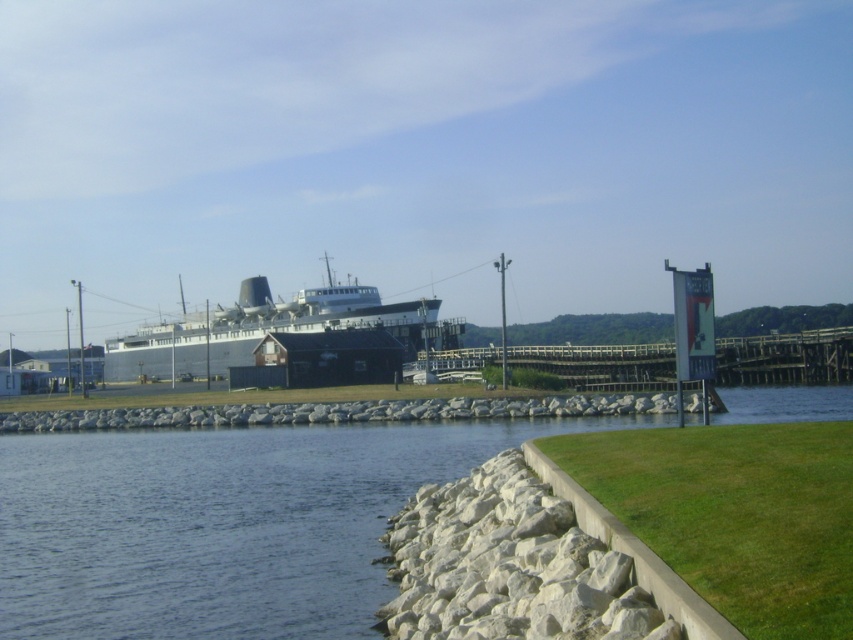
Does clear water at lower left appear on the right side of wooden planks at center?

No, clear water at lower left is not to the right of wooden planks at center.

Is point (369, 426) farther from camera compared to point (612, 346)?

No.

This screenshot has width=853, height=640. I want to click on clear water at lower left, so click(x=213, y=524).

Can you confirm if clear water at lower left is shorter than gray metallic ship at center?

Yes, clear water at lower left is shorter than gray metallic ship at center.

Can you confirm if clear water at lower left is smaller than gray metallic ship at center?

Indeed, clear water at lower left has a smaller size compared to gray metallic ship at center.

Which is behind, point (218, 570) or point (374, 308)?

The point (374, 308) is more distant.

Where is `clear water at lower left`? clear water at lower left is located at coordinates (213, 524).

Does gray metallic ship at center have a greater height compared to wooden planks at center?

Indeed, gray metallic ship at center has a greater height compared to wooden planks at center.

Who is more forward, (x=393, y=308) or (x=769, y=349)?

Point (x=769, y=349) is in front.

Where is `gray metallic ship at center`? This screenshot has width=853, height=640. gray metallic ship at center is located at coordinates (270, 330).